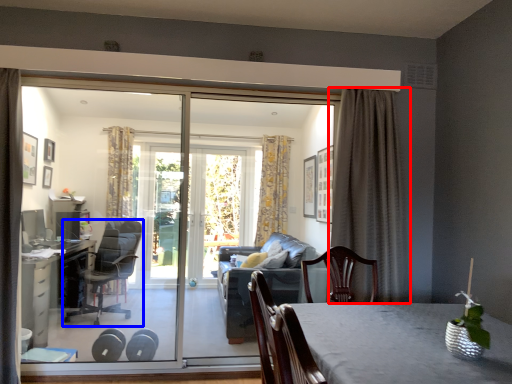
Question: Which point is further to the camera, curtain (highlighted by a red box) or chair (highlighted by a blue box)?

Choices:
 (A) curtain
 (B) chair

Answer: (B)